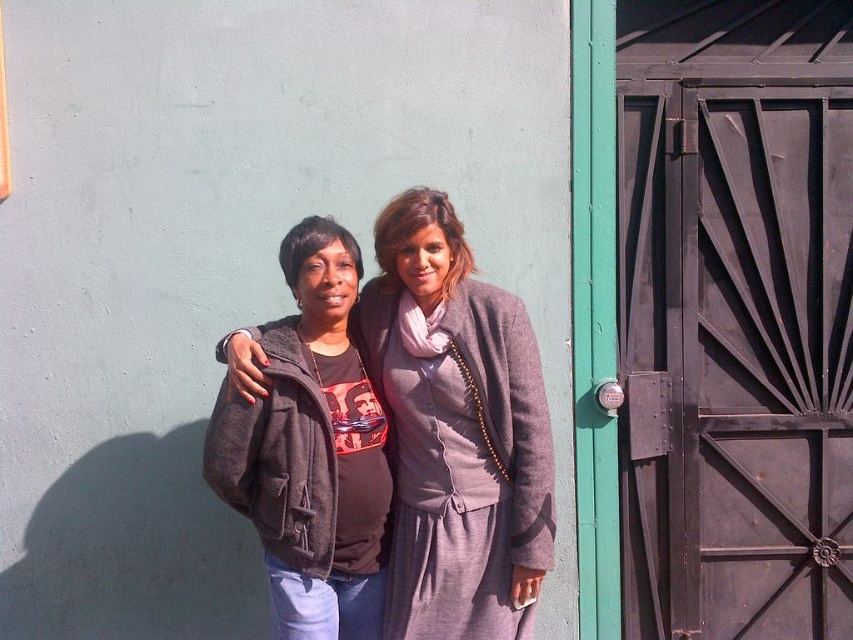
You are a tailor measuring the distance between two garments for a display. You have a display stand that can only accommodate items spaced 10 inches apart. Can the matte gray sweater at center and the matte brown jacket at center be placed on the stand without violating the spacing requirement?

The distance between the matte gray sweater at center and the matte brown jacket at center is 9.73 inches, which is less than the required 10 inches. Therefore, they can be placed on the stand without violating the spacing requirement.

From the picture: You are a painter who needs to hang a 1.2 meter tall painting on the wall. You have to choose between placing it either above the black metal door at right or above the matte brown jacket at center. Based on their positions in the image, which location would allow the painting to fit vertically without exceeding the wall space?

The black metal door at right is above the matte brown jacket at center. Since the painting is 1.2 meters tall, placing it above the black metal door at right would provide sufficient vertical space as it is positioned higher on the wall compared to the matte brown jacket at center.

You are a delivery person who needs to deliver a package to the black metal door at right. You are currently standing near the matte gray sweater at center. Which direction should you move to reach the door?

The black metal door at right is positioned on the right side of matte gray sweater at center, so you should move to your right to reach the door.